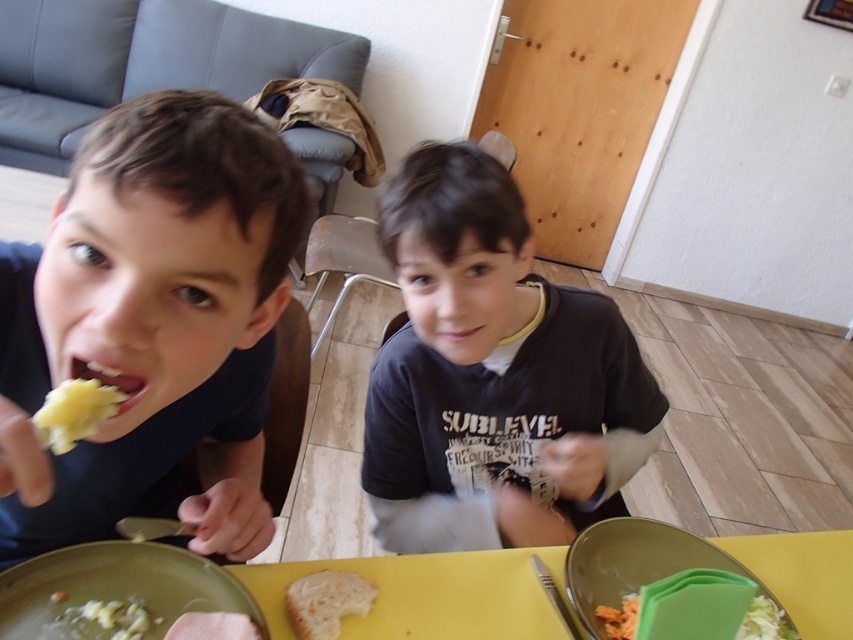
You are a waiter in a restaurant and need to place a small plate between the two points on the table. The points are point (x=62, y=401) and point (x=177, y=627). Which point should the plate be closer to so it stays between them?

The plate should be placed closer to point (x=177, y=627) because point (x=62, y=401) is in front of point (x=177, y=627), meaning the latter is behind the former. Placing the plate closer to the rear point ensures it stays between them.

You are a parent observing your children eating. You notice the white creamy pasta at lower left and the pink matte skin at center on the table. Which item is closer to the left edge of the table?

The white creamy pasta at lower left is closer to the left edge of the table because it is positioned on the left side of the pink matte skin at center.